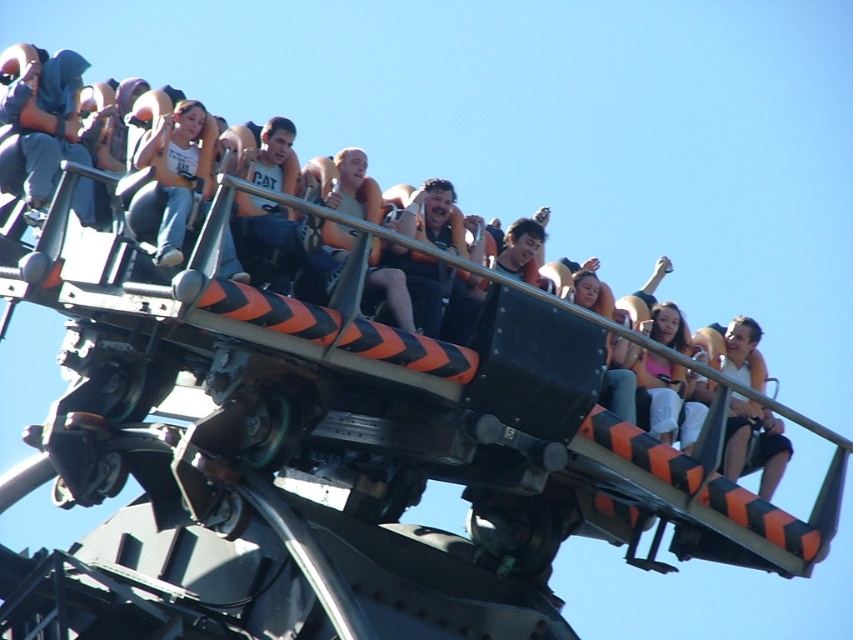
Question: Estimate the real-world distances between objects in this image. Which object is closer to the white matte shirt at upper right?

Choices:
 (A) matte orange vest at center
 (B) matte black shirt at center
 (C) pink fabric at center
 (D) matte white tank top at center

Answer: (C)

Question: Which point is farther to the camera?

Choices:
 (A) matte black shirt at center
 (B) matte white tank top at center
 (C) orange life vest at center

Answer: (A)

Question: Which of these objects is positioned farthest from the orange life vest at center?

Choices:
 (A) matte black shirt at center
 (B) pink fabric at center
 (C) matte orange vest at center
 (D) matte white tank top at center

Answer: (B)

Question: Is matte black shirt at center above orange life vest at center?

Choices:
 (A) no
 (B) yes

Answer: (A)

Question: Does matte orange vest at center appear under pink fabric at center?

Choices:
 (A) yes
 (B) no

Answer: (B)

Question: Is matte black shirt at center smaller than pink fabric at center?

Choices:
 (A) no
 (B) yes

Answer: (A)